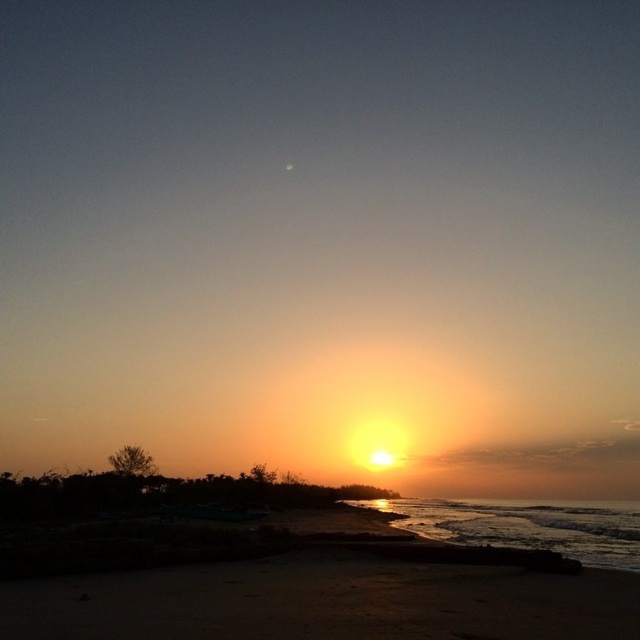
Question: Among these objects, which one is farthest from the camera?

Choices:
 (A) shiny metallic water at lower right
 (B) sandy beach at lower center

Answer: (A)

Question: Is the position of sandy beach at lower center less distant than that of shiny metallic water at lower right?

Choices:
 (A) no
 (B) yes

Answer: (B)

Question: Where is sandy beach at lower center located in relation to shiny metallic water at lower right in the image?

Choices:
 (A) below
 (B) above

Answer: (B)

Question: Which of the following is the closest to the observer?

Choices:
 (A) shiny metallic water at lower right
 (B) sandy beach at lower center

Answer: (B)

Question: Among these points, which one is nearest to the camera?

Choices:
 (A) (605, 525)
 (B) (480, 634)

Answer: (B)

Question: From the image, what is the correct spatial relationship of sandy beach at lower center in relation to shiny metallic water at lower right?

Choices:
 (A) right
 (B) left

Answer: (B)